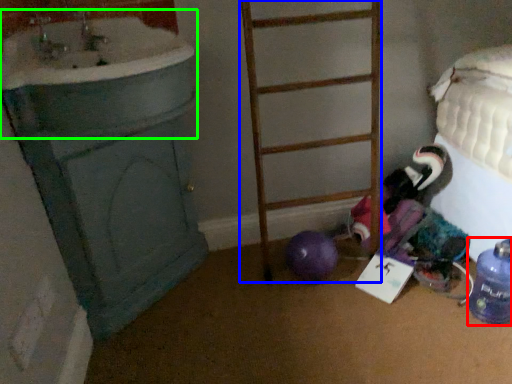
Question: Which object is the farthest from bottle (highlighted by a red box)? Choose among these: ladder (highlighted by a blue box) or sink (highlighted by a green box).

Choices:
 (A) ladder
 (B) sink

Answer: (B)